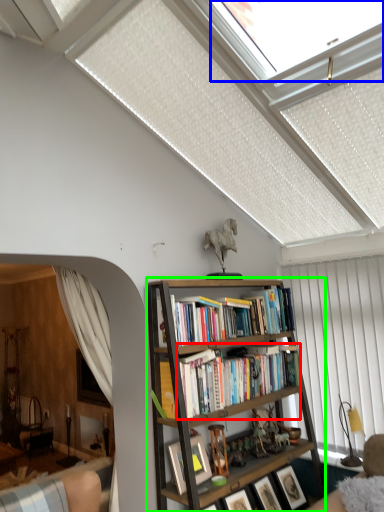
Question: Based on their relative distances, which object is farther from book (highlighted by a red box)? Choose from window (highlighted by a blue box) and bookcase (highlighted by a green box).

Choices:
 (A) window
 (B) bookcase

Answer: (A)